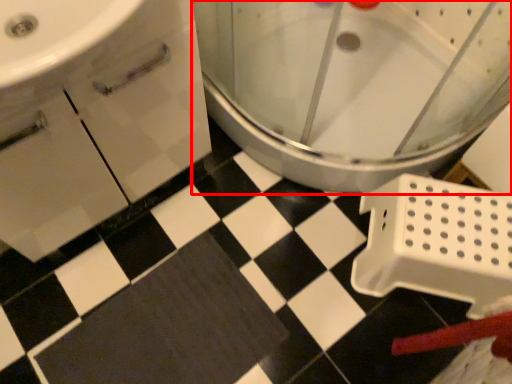
Question: From the image's perspective, where is toilet (annotated by the red box) located in relation to bath mat in the image?

Choices:
 (A) above
 (B) below

Answer: (A)